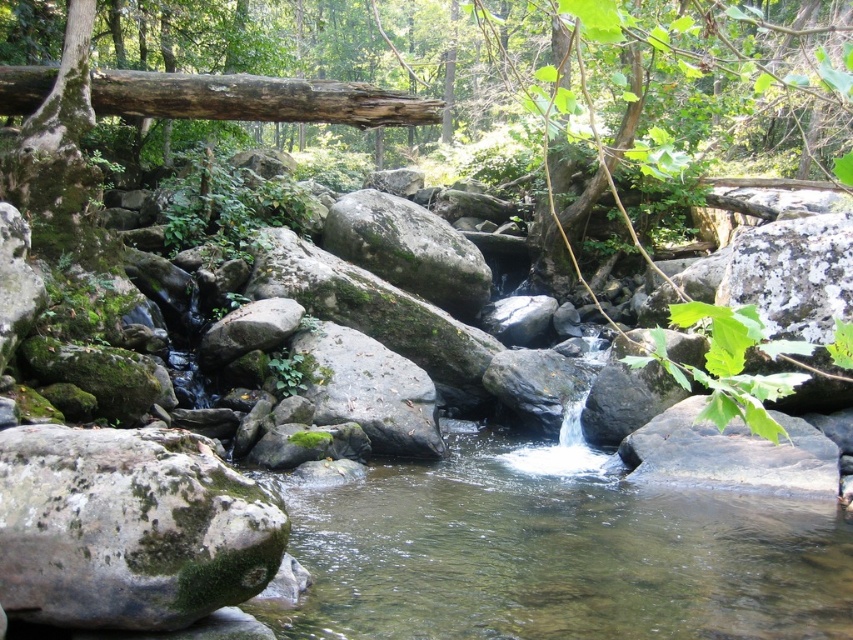
Which is more to the left, brown rough log at upper left or smooth gray rock at lower right?

brown rough log at upper left is more to the left.

Is brown rough log at upper left shorter than smooth gray rock at lower right?

Yes, brown rough log at upper left is shorter than smooth gray rock at lower right.

Which is in front, point (370, 100) or point (761, 438)?

Positioned in front is point (761, 438).

Where is `brown rough log at upper left`? This screenshot has height=640, width=853. brown rough log at upper left is located at coordinates (256, 99).

Can you confirm if brown rough log at upper left is positioned above green mossy rock at center?

Correct, brown rough log at upper left is located above green mossy rock at center.

Looking at this image, is brown rough log at upper left closer to the viewer compared to green mossy rock at center?

Yes, brown rough log at upper left is in front of green mossy rock at center.

At what (x,y) coordinates should I click in order to perform the action: click on brown rough log at upper left. Please return your answer as a coordinate pair (x, y). Looking at the image, I should click on (256, 99).

Image resolution: width=853 pixels, height=640 pixels. What are the coordinates of `brown rough log at upper left` in the screenshot? It's located at (256, 99).

Who is taller, green mossy rock at lower left or brown rough log at upper left?

Standing taller between the two is green mossy rock at lower left.

Who is positioned more to the left, green mossy rock at lower left or brown rough log at upper left?

brown rough log at upper left

Which is in front, point (254, 493) or point (229, 104)?

Point (254, 493) is in front.

Find the location of a particular element. The image size is (853, 640). green mossy rock at lower left is located at coordinates (128, 529).